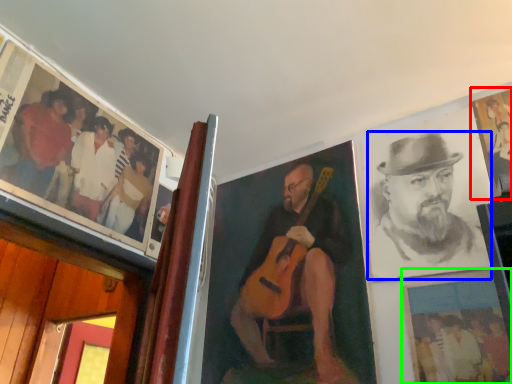
Question: Which object is positioned farthest from picture frame (highlighted by a red box)? Select from man (highlighted by a blue box) and picture frame (highlighted by a green box).

Choices:
 (A) man
 (B) picture frame

Answer: (B)